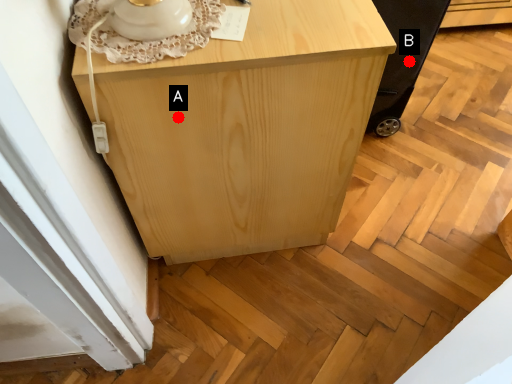
Question: Two points are circled on the image, labeled by A and B beside each circle. Which point is closer to the camera taking this photo?

Choices:
 (A) A is closer
 (B) B is closer

Answer: (A)